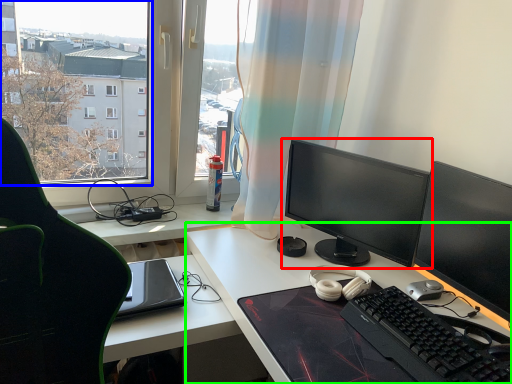
Question: Which is nearer to the computer monitor (highlighted by a red box)? window screen (highlighted by a blue box) or desk (highlighted by a green box).

Choices:
 (A) window screen
 (B) desk

Answer: (B)